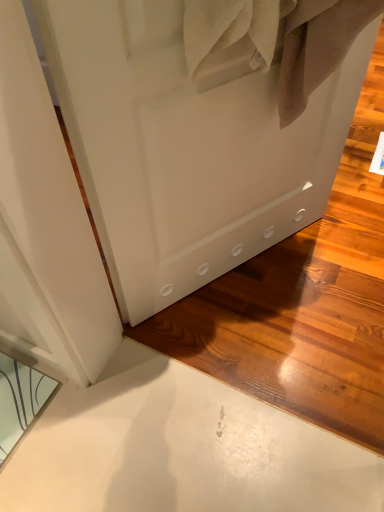
Question: Looking at their shapes, would you say clear glass mirror at lower left is wider or thinner than white matte door at center?

Choices:
 (A) thin
 (B) wide

Answer: (B)

Question: From a real-world perspective, relative to white matte door at center, is clear glass mirror at lower left vertically above or below?

Choices:
 (A) below
 (B) above

Answer: (A)

Question: Considering the positions of point (38, 388) and point (253, 197), is point (38, 388) closer or farther from the camera than point (253, 197)?

Choices:
 (A) closer
 (B) farther

Answer: (A)

Question: Do you think white matte door at center is within clear glass mirror at lower left, or outside of it?

Choices:
 (A) outside
 (B) inside

Answer: (A)

Question: Is white matte door at center in front of or behind clear glass mirror at lower left in the image?

Choices:
 (A) front
 (B) behind

Answer: (A)

Question: Looking at the image, does white matte door at center seem bigger or smaller compared to clear glass mirror at lower left?

Choices:
 (A) small
 (B) big

Answer: (B)

Question: Is point (314, 185) positioned closer to the camera than point (0, 384)?

Choices:
 (A) farther
 (B) closer

Answer: (A)